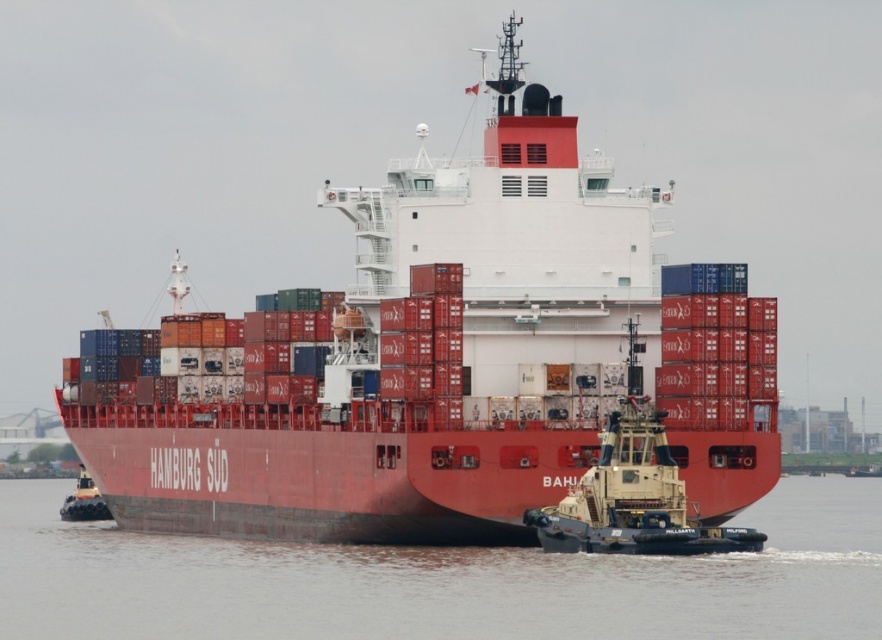
Question: Which point is farther to the camera?

Choices:
 (A) (26, 560)
 (B) (310, 483)

Answer: (A)

Question: Which point appears closest to the camera in this image?

Choices:
 (A) (566, 550)
 (B) (230, 580)
 (C) (484, 480)

Answer: (A)

Question: Is red matte container ship at center below camouflage paint tugboat at lower right?

Choices:
 (A) yes
 (B) no

Answer: (B)

Question: Can you confirm if red matte container ship at center is thinner than camouflage paint tugboat at lower right?

Choices:
 (A) yes
 (B) no

Answer: (B)

Question: Is red matte container ship at center below smooth water at lower center?

Choices:
 (A) no
 (B) yes

Answer: (A)

Question: Which point is farther from the camera taking this photo?

Choices:
 (A) (225, 330)
 (B) (628, 445)
 (C) (667, 595)

Answer: (A)